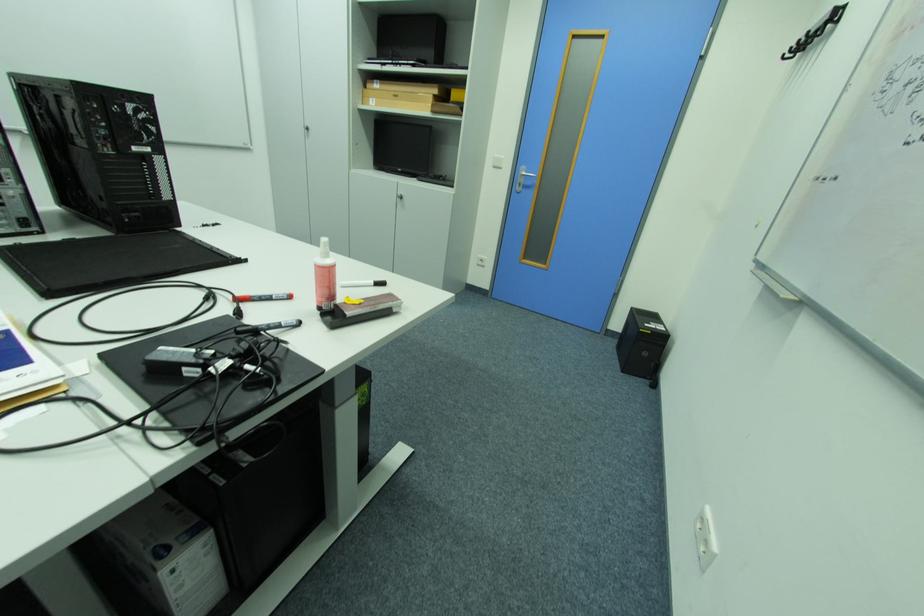
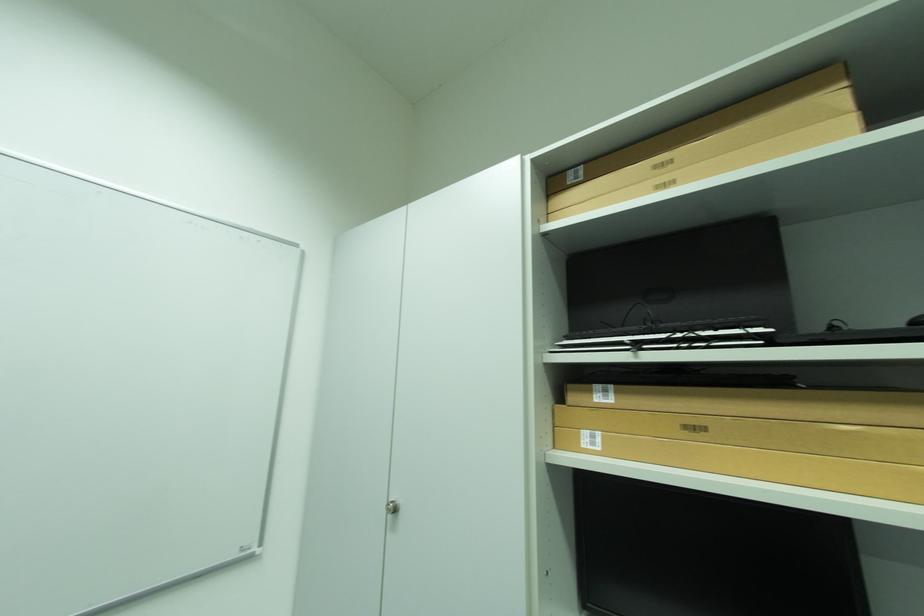
Find the pixel in the second image that matches point 379,100 in the first image.

(593, 434)